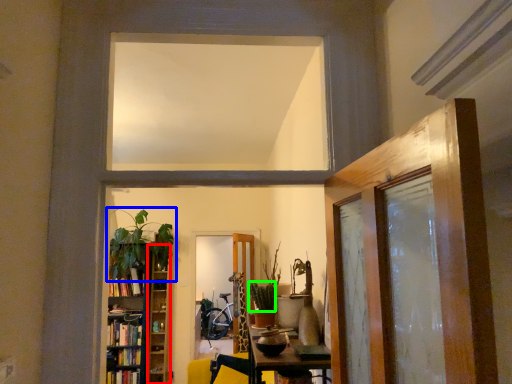
Question: Which object is the farthest from shelf (highlighted by a red box)? Choose among these: houseplant (highlighted by a blue box) or plant (highlighted by a green box).

Choices:
 (A) houseplant
 (B) plant

Answer: (B)